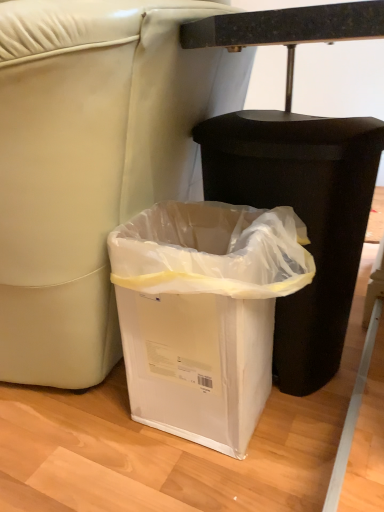
Question: From their relative heights in the image, would you say black plastic waste container at lower center, which ranks as the first waste container in right-to-left order, is taller or shorter than white plastic waste container at lower center, positioned as the first waste container in left-to-right order?

Choices:
 (A) short
 (B) tall

Answer: (B)

Question: From a real-world perspective, relative to white plastic waste container at lower center, which ranks as the second waste container in right-to-left order, is black plastic waste container at lower center, which ranks as the first waste container in right-to-left order, vertically above or below?

Choices:
 (A) below
 (B) above

Answer: (B)

Question: Is point (362, 201) positioned closer to the camera than point (203, 259)?

Choices:
 (A) closer
 (B) farther

Answer: (B)

Question: From a real-world perspective, is white plastic waste container at lower center, positioned as the first waste container in left-to-right order, positioned above or below black plastic waste container at lower center, which appears as the 2th waste container when viewed from the left?

Choices:
 (A) below
 (B) above

Answer: (A)

Question: Is white plastic waste container at lower center, positioned as the first waste container in left-to-right order, inside or outside of black plastic waste container at lower center, which ranks as the first waste container in right-to-left order?

Choices:
 (A) outside
 (B) inside

Answer: (A)

Question: From their relative heights in the image, would you say white plastic waste container at lower center, positioned as the first waste container in left-to-right order, is taller or shorter than black plastic waste container at lower center, which ranks as the first waste container in right-to-left order?

Choices:
 (A) short
 (B) tall

Answer: (A)

Question: Considering their positions, is white plastic waste container at lower center, positioned as the first waste container in left-to-right order, located in front of or behind black plastic waste container at lower center, which ranks as the first waste container in right-to-left order?

Choices:
 (A) front
 (B) behind

Answer: (A)